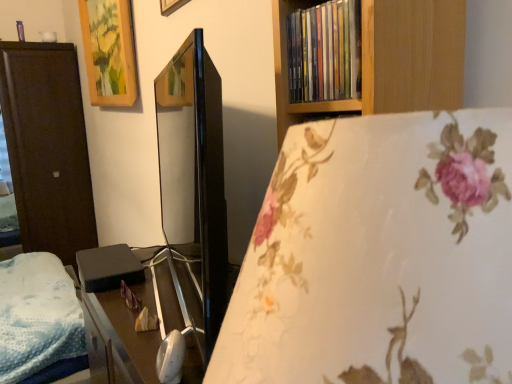
Find the location of a particular element. This screenshot has width=512, height=384. vacant space situated above black matte/black box at left (from a real-world perspective) is located at coordinates (96, 257).